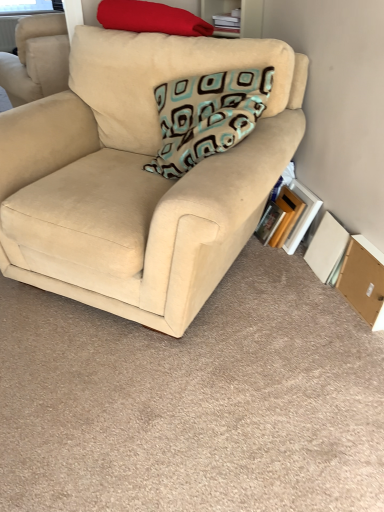
Question: From a real-world perspective, is hardcover book at lower right, which is the second paperback book from left to right, positioned above or below brown cardboard box at lower right?

Choices:
 (A) below
 (B) above

Answer: (B)

Question: Considering the positions of hardcover book at lower right, which is the second paperback book from left to right, and brown cardboard box at lower right in the image, is hardcover book at lower right, which is the second paperback book from left to right, taller or shorter than brown cardboard box at lower right?

Choices:
 (A) tall
 (B) short

Answer: (A)

Question: Which of these objects is positioned closest to the brown cardboard box at lower right?

Choices:
 (A) beige fabric couch at center
 (B) stacked books at upper center
 (C) hardcover book at lower right, the 2th paperback book positioned from the right
 (D) teal-patterned fabric pillow at center, which ranks as the 2th pillow in top-to-bottom order
 (E) matte red pillow at upper left, the 1th pillow positioned from the top

Answer: (C)

Question: Considering the real-world distances, which object is closest to the teal-patterned fabric pillow at center, arranged as the first pillow when ordered from the bottom?

Choices:
 (A) matte red pillow at upper left, the 1th pillow positioned from the top
 (B) beige fabric couch at center
 (C) hardcover book at lower right, the 2th paperback book positioned from the right
 (D) brown cardboard box at lower right
 (E) white cardboard book at lower right, the first paperback book in the right-to-left sequence

Answer: (B)